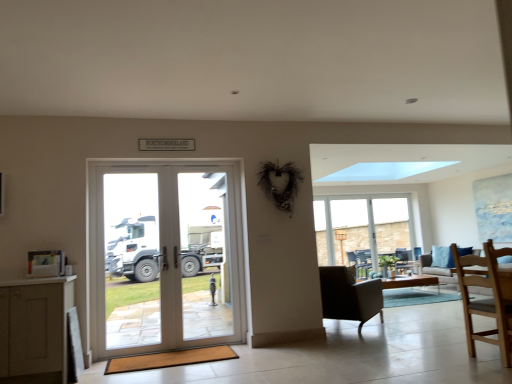
Question: Considering the relative sizes of clear glass door at center and green matte vase at center in the image provided, is clear glass door at center smaller than green matte vase at center?

Choices:
 (A) yes
 (B) no

Answer: (B)

Question: Is clear glass door at center placed right next to green matte vase at center?

Choices:
 (A) yes
 (B) no

Answer: (B)

Question: Is clear glass door at center shorter than green matte vase at center?

Choices:
 (A) no
 (B) yes

Answer: (A)

Question: From the image's perspective, is clear glass door at center under green matte vase at center?

Choices:
 (A) yes
 (B) no

Answer: (B)

Question: Does clear glass door at center come behind green matte vase at center?

Choices:
 (A) no
 (B) yes

Answer: (A)

Question: From a real-world perspective, relative to clear glass door at center, is wooden table at center vertically above or below?

Choices:
 (A) above
 (B) below

Answer: (B)

Question: Considering the positions of wooden table at center and clear glass door at center in the image, is wooden table at center taller or shorter than clear glass door at center?

Choices:
 (A) tall
 (B) short

Answer: (B)

Question: Relative to clear glass door at center, is wooden table at center in front or behind?

Choices:
 (A) behind
 (B) front

Answer: (A)

Question: Considering the positions of wooden table at center and clear glass door at center in the image, is wooden table at center wider or thinner than clear glass door at center?

Choices:
 (A) wide
 (B) thin

Answer: (A)

Question: Is white glass door at center bigger or smaller than light gray fabric couch at right?

Choices:
 (A) small
 (B) big

Answer: (A)

Question: Choose the correct answer: Is white glass door at center inside light gray fabric couch at right or outside it?

Choices:
 (A) outside
 (B) inside

Answer: (A)

Question: Looking at their shapes, would you say white glass door at center is wider or thinner than light gray fabric couch at right?

Choices:
 (A) thin
 (B) wide

Answer: (A)

Question: From the image's perspective, relative to light gray fabric couch at right, is white glass door at center above or below?

Choices:
 (A) above
 (B) below

Answer: (A)

Question: Is clear glass door at center to the left or to the right of clear glass window at center in the image?

Choices:
 (A) left
 (B) right

Answer: (A)

Question: Is point 199,223 closer or farther from the camera than point 340,261?

Choices:
 (A) farther
 (B) closer

Answer: (B)